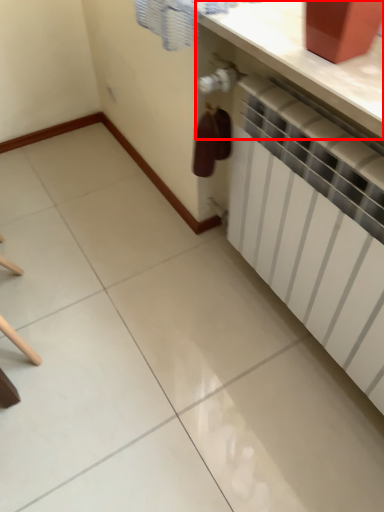
Question: From the image's perspective, where is counter top (annotated by the red box) located relative to radiator?

Choices:
 (A) below
 (B) above

Answer: (B)